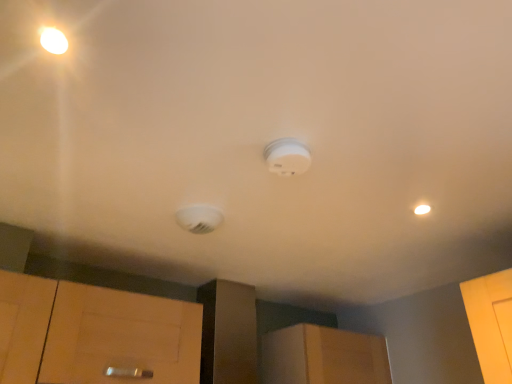
Question: Does wooden cabinet at center contain white plastic smoke detector at center?

Choices:
 (A) yes
 (B) no

Answer: (B)

Question: Does wooden cabinet at center have a larger size compared to white plastic smoke detector at center?

Choices:
 (A) no
 (B) yes

Answer: (B)

Question: Is wooden cabinet at center at the left side of white plastic smoke detector at center?

Choices:
 (A) yes
 (B) no

Answer: (B)

Question: From a real-world perspective, is wooden cabinet at center on top of white plastic smoke detector at center?

Choices:
 (A) no
 (B) yes

Answer: (A)

Question: Is the position of wooden cabinet at center more distant than that of white plastic smoke detector at center?

Choices:
 (A) no
 (B) yes

Answer: (B)

Question: Is wooden cabinet at center oriented towards white plastic smoke detector at center?

Choices:
 (A) yes
 (B) no

Answer: (B)

Question: Is white plastic smoke detector at center wider than wooden cabinet at center?

Choices:
 (A) no
 (B) yes

Answer: (A)

Question: Considering the relative sizes of white plastic smoke detector at center and wooden cabinet at center in the image provided, is white plastic smoke detector at center smaller than wooden cabinet at center?

Choices:
 (A) yes
 (B) no

Answer: (A)

Question: Is white plastic smoke detector at center at the right side of wooden cabinet at center?

Choices:
 (A) yes
 (B) no

Answer: (B)

Question: Is wooden cabinet at center at the back of white plastic smoke detector at center?

Choices:
 (A) no
 (B) yes

Answer: (A)

Question: Is white plastic smoke detector at center thinner than wooden cabinet at center?

Choices:
 (A) no
 (B) yes

Answer: (B)

Question: Is the depth of white plastic smoke detector at center greater than that of wooden cabinet at center?

Choices:
 (A) yes
 (B) no

Answer: (B)

Question: From a real-world perspective, relative to white plastic smoke detector at center, is wooden cabinet at center vertically above or below?

Choices:
 (A) above
 (B) below

Answer: (B)